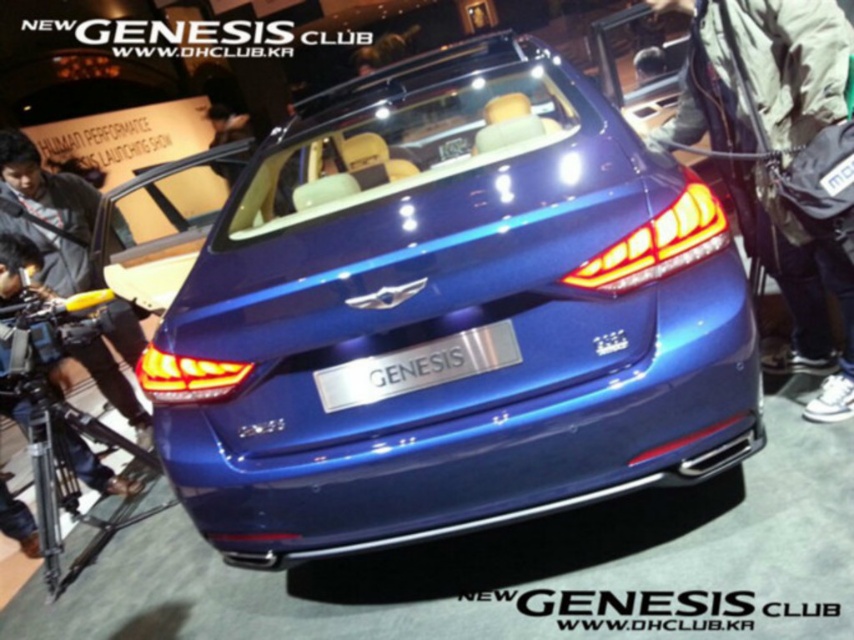
In the scene shown: You are a photographer standing at the rear of the metallic blue car at center. You want to take a photo of the dark blue leather jacket at left without moving the car. Is the jacket within your reach to adjust its position?

The metallic blue car at center is 2.20 meters away from the dark blue leather jacket at left. Since the photographer is standing at the car, they would need to move 2.20 meters to reach the jacket, which may be challenging without moving the car.

You are a photographer standing at the rear of the metallic blue car at center and silver metallic plate at center. You want to take a photo of both objects without any overlap. What is the minimum distance you need to move backward to ensure they are fully visible in the frame?

The metallic blue car at center is 18.08 inches away from the silver metallic plate at center. To capture both objects without overlap, you need to move backward until the distance between them appears smaller in the frame. The exact distance depends on your camera lens and sensor size, but ensuring the separation of 18.08 inches is within the field of view will work.